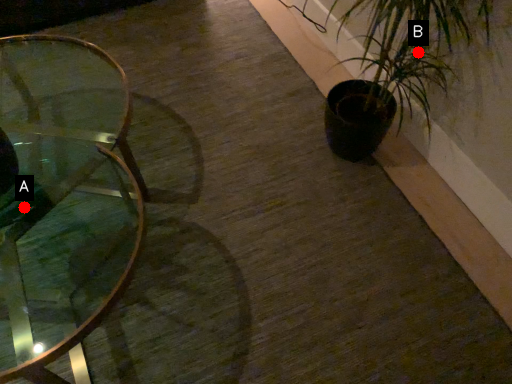
Question: Two points are circled on the image, labeled by A and B beside each circle. Which point appears farthest from the camera in this image?

Choices:
 (A) A is further
 (B) B is further

Answer: (A)